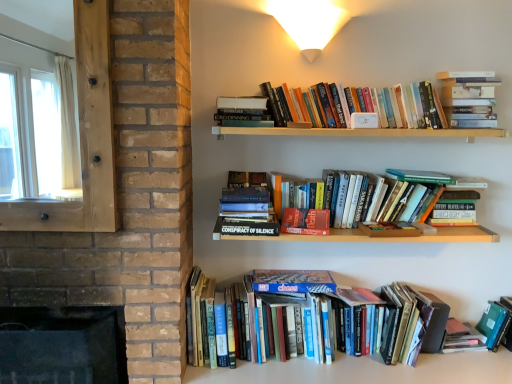
You are a GUI agent. You are given a task and a screenshot of the screen. Output one action in this format:
    pyautogui.click(x=<x>, y=<y>)
    Task: Click on the free space to the left of hardcover book at lower right, placed as the third paperback book when sorted from top to bottom
    Image resolution: width=512 pixels, height=384 pixels.
    Given the screenshot: What is the action you would take?
    pyautogui.click(x=434, y=362)